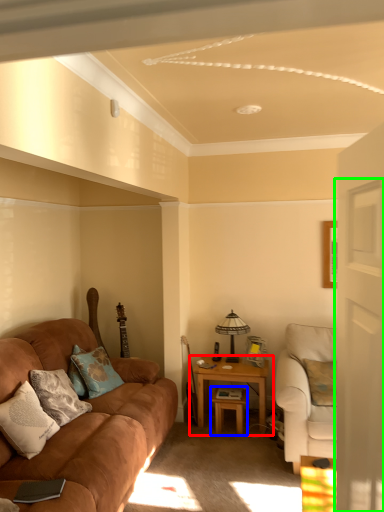
Question: Estimate the real-world distances between objects in this image. Which object is farther from table (highlighted by a red box), table (highlighted by a blue box) or glass door (highlighted by a green box)?

Choices:
 (A) table
 (B) glass door

Answer: (B)